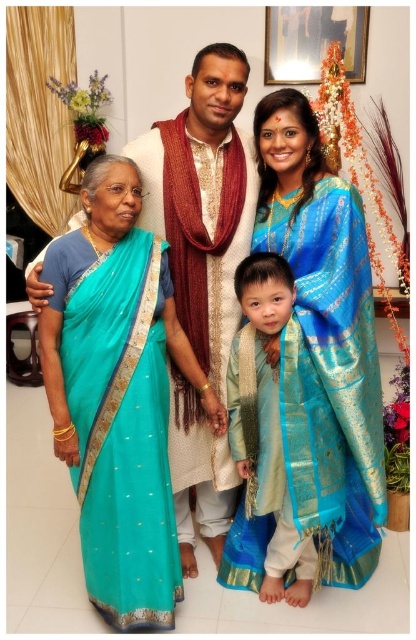
Question: Estimate the real-world distances between objects in this image. Which object is farther from the teal silk saree at left?

Choices:
 (A) silk blue kurta at center
 (B) blue silk saree at center

Answer: (B)

Question: Can you confirm if teal silk saree at left is positioned above silk blue kurta at center?

Choices:
 (A) no
 (B) yes

Answer: (B)

Question: Which of the following is the closest to the observer?

Choices:
 (A) silk blue kurta at center
 (B) teal silk saree at left

Answer: (B)

Question: Does teal silk saree at left have a smaller size compared to blue silk saree at center?

Choices:
 (A) no
 (B) yes

Answer: (B)

Question: Does teal silk saree at left have a greater width compared to silk blue kurta at center?

Choices:
 (A) no
 (B) yes

Answer: (B)

Question: Which of the following is the farthest from the observer?

Choices:
 (A) (150, 353)
 (B) (277, 387)

Answer: (B)